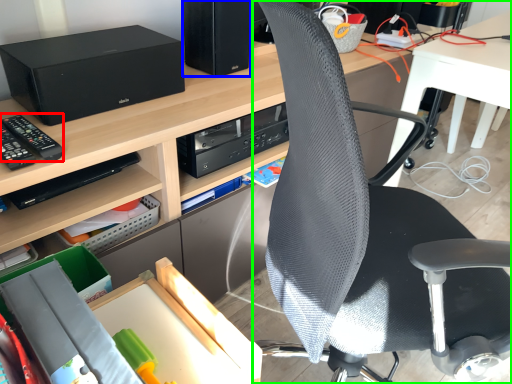
Question: Considering the real-world distances, which object is closest to equipment (highlighted by a red box)? computer tower (highlighted by a blue box) or chair (highlighted by a green box).

Choices:
 (A) computer tower
 (B) chair

Answer: (A)